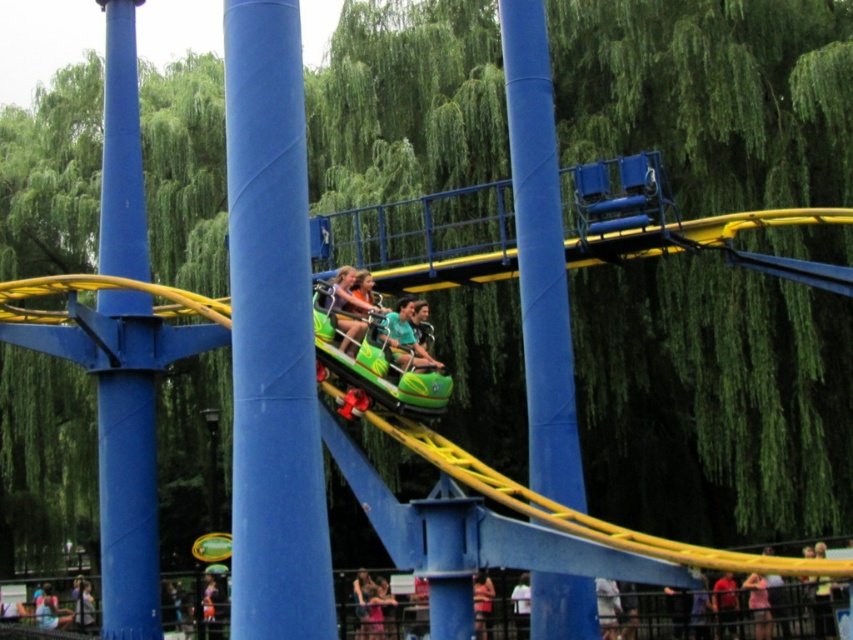
Can you confirm if green plastic roller coaster car at center is thinner than green matte roller coaster car at center?

No.

Which of these two, green plastic roller coaster car at center or green matte roller coaster car at center, stands shorter?

With less height is green matte roller coaster car at center.

Which is in front, point (402, 374) or point (351, 284)?

Point (402, 374) is in front.

I want to click on green plastic roller coaster car at center, so click(x=376, y=349).

Who is taller, blue glossy pole at center or blue metallic pole at center?

blue metallic pole at center

Can you confirm if blue glossy pole at center is bigger than blue metallic pole at center?

Actually, blue glossy pole at center might be smaller than blue metallic pole at center.

Image resolution: width=853 pixels, height=640 pixels. In order to click on blue glossy pole at center in this screenshot , I will do `click(271, 336)`.

You are a GUI agent. You are given a task and a screenshot of the screen. Output one action in this format:
    pyautogui.click(x=<x>, y=<y>)
    Task: Click on the blue glossy pole at center
    
    Given the screenshot: What is the action you would take?
    pyautogui.click(x=271, y=336)

Can you confirm if green plastic roller coaster car at center is bigger than green plastic helmet at center?

Yes.

Between green plastic roller coaster car at center and green plastic helmet at center, which one has less height?

With less height is green plastic helmet at center.

The height and width of the screenshot is (640, 853). Find the location of `green plastic roller coaster car at center`. green plastic roller coaster car at center is located at coordinates (376, 349).